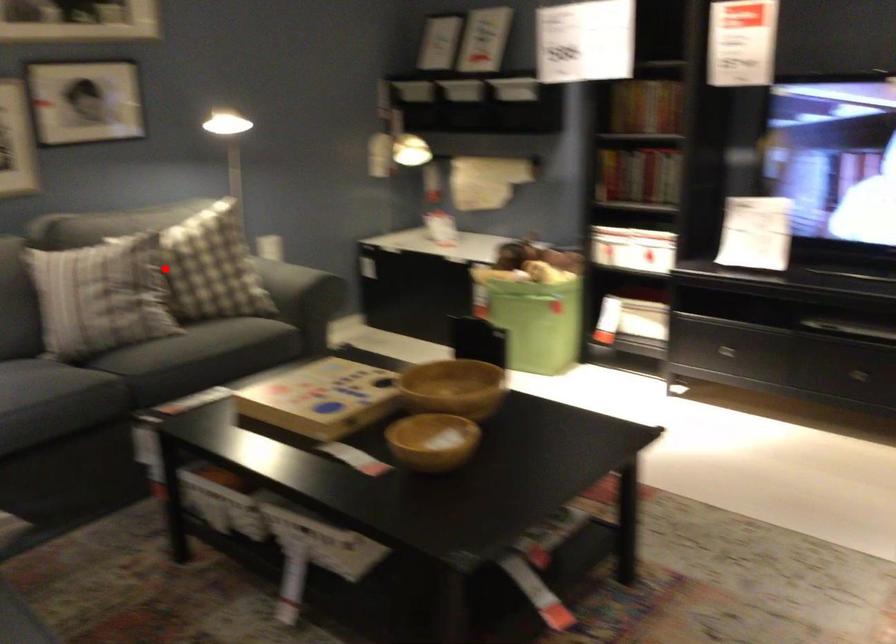
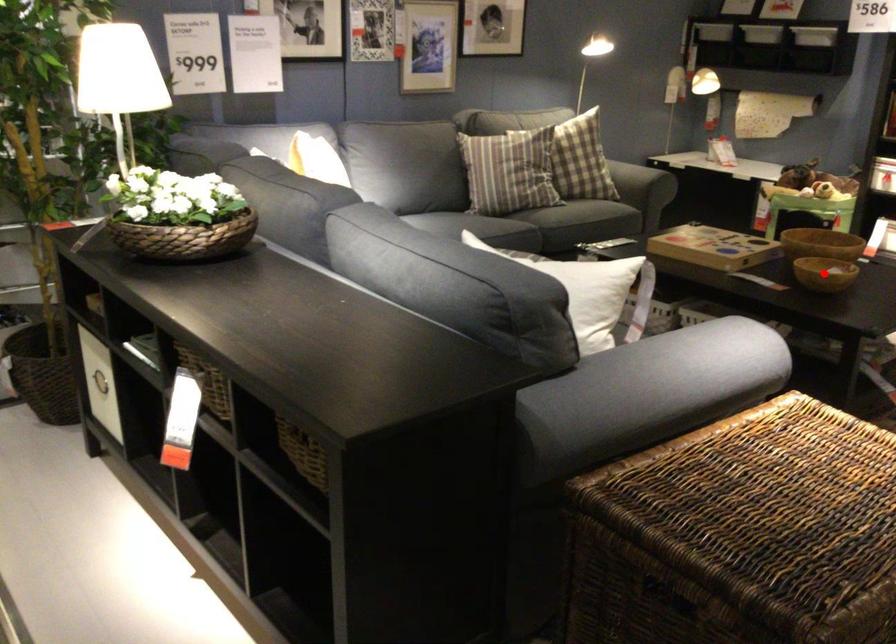
I am providing you with two images of the same scene from different viewpoints. A red point is marked on the first image and another point is marked on the second image. Is the marked point in image1 the same physical position as the marked point in image2?

No